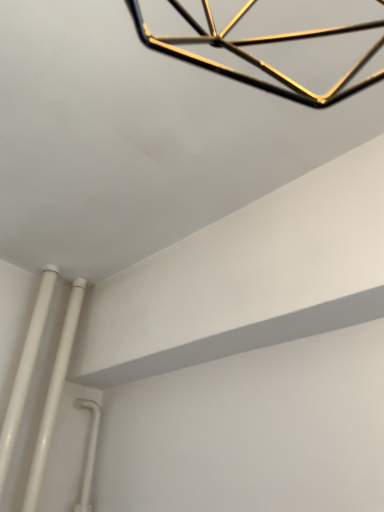
Question: From a real-world perspective, relative to white glossy pipe at lower left, which is counted as the second pipe, starting from the right, is white glossy pipes at lower left, which is counted as the second pipe, starting from the left, vertically above or below?

Choices:
 (A) below
 (B) above

Answer: (B)

Question: Is white glossy pipes at lower left, arranged as the 1th pipe when viewed from the right, inside the boundaries of white glossy pipe at lower left, which is counted as the second pipe, starting from the right, or outside?

Choices:
 (A) outside
 (B) inside

Answer: (A)

Question: Is white glossy pipes at lower left, arranged as the 1th pipe when viewed from the right, bigger or smaller than white glossy pipe at lower left, which is counted as the second pipe, starting from the right?

Choices:
 (A) small
 (B) big

Answer: (B)

Question: Is white glossy pipe at lower left, positioned as the first pipe in left-to-right order, taller or shorter than white glossy pipes at lower left, arranged as the 1th pipe when viewed from the right?

Choices:
 (A) short
 (B) tall

Answer: (B)

Question: From the image's perspective, is white glossy pipe at lower left, which is counted as the second pipe, starting from the right, positioned above or below white glossy pipes at lower left, arranged as the 1th pipe when viewed from the right?

Choices:
 (A) above
 (B) below

Answer: (A)

Question: Considering the positions of white glossy pipe at lower left, which is counted as the second pipe, starting from the right, and white glossy pipes at lower left, arranged as the 1th pipe when viewed from the right, in the image, is white glossy pipe at lower left, which is counted as the second pipe, starting from the right, bigger or smaller than white glossy pipes at lower left, arranged as the 1th pipe when viewed from the right,?

Choices:
 (A) small
 (B) big

Answer: (A)

Question: Is white glossy pipe at lower left, which is counted as the second pipe, starting from the right, spatially inside white glossy pipes at lower left, which is counted as the second pipe, starting from the left, or outside of it?

Choices:
 (A) outside
 (B) inside

Answer: (A)